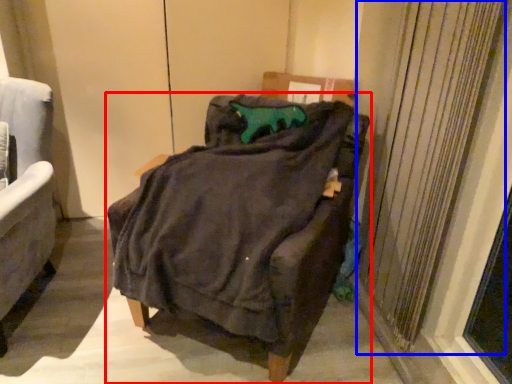
Question: Among these objects, which one is farthest to the camera, chair (highlighted by a red box) or curtain (highlighted by a blue box)?

Choices:
 (A) chair
 (B) curtain

Answer: (B)